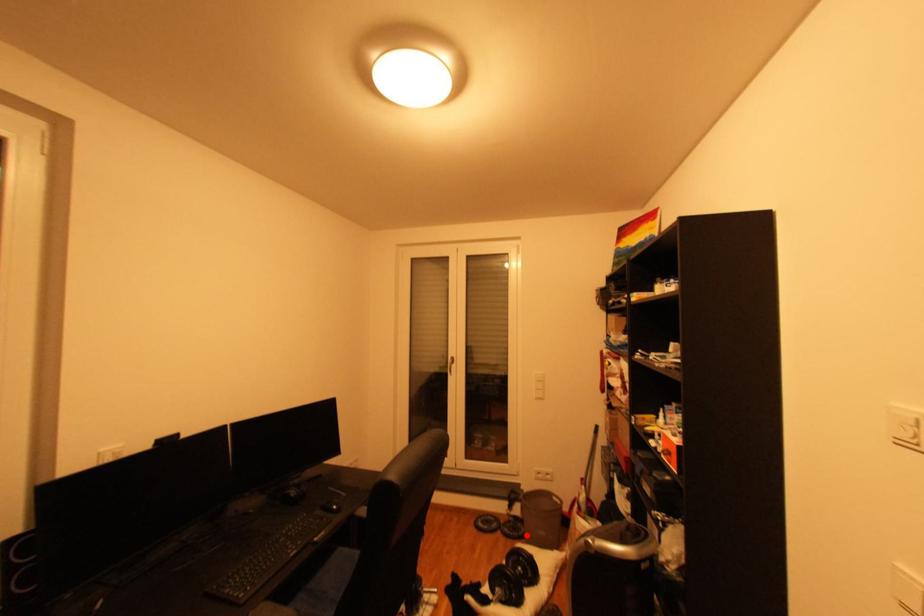
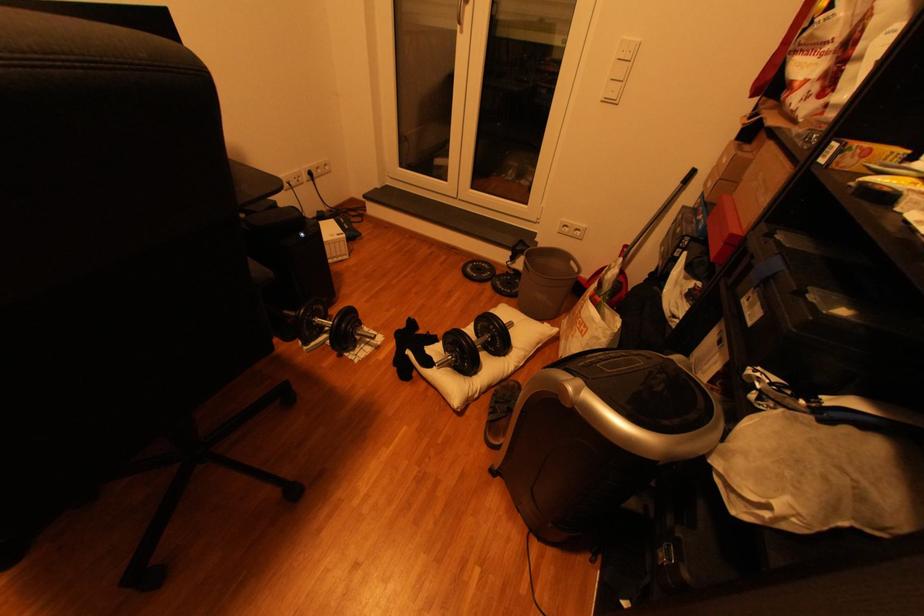
Find the pixel in the second image that matches the highlighted location in the first image.

(518, 292)